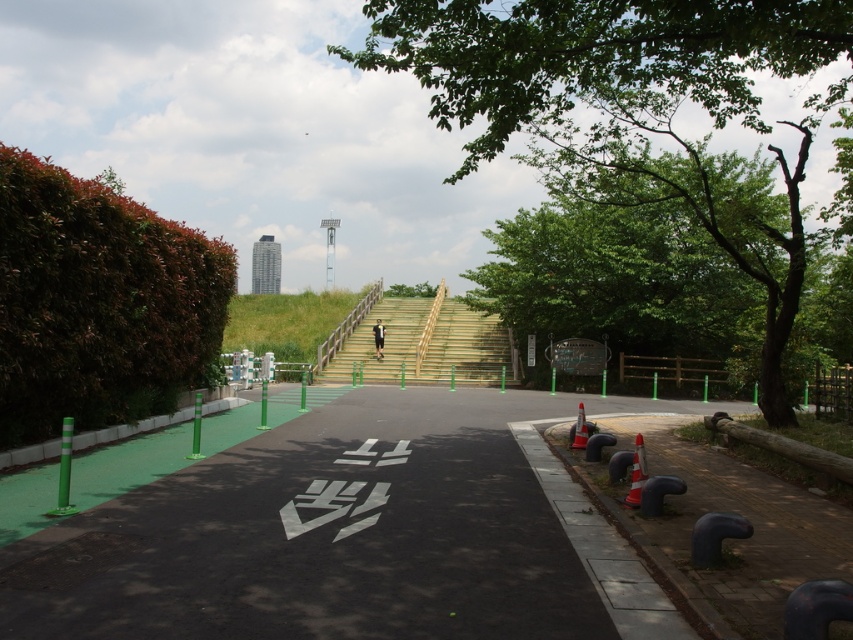
Question: Which object is positioned closest to the orange traffic cone at center?

Choices:
 (A) green leafy tree at center
 (B) blue rubber bollards at lower right
 (C) green leafy bush at left

Answer: (B)

Question: Among these objects, which one is farthest from the camera?

Choices:
 (A) green leafy tree at center
 (B) green leafy bush at left
 (C) black asphalt path at center
 (D) wooden stairs at center

Answer: (D)

Question: Can you confirm if blue rubber bollards at lower right is positioned to the left of wooden stairs at center?

Choices:
 (A) yes
 (B) no

Answer: (B)

Question: Can you confirm if green leafy tree at center is bigger than orange cone at center?

Choices:
 (A) yes
 (B) no

Answer: (A)

Question: Which point is closer to the camera?

Choices:
 (A) orange reflective cone at lower right
 (B) orange cone at center
 (C) green leafy bush at left
 (D) wooden stairs at center

Answer: (A)

Question: Can you confirm if green leafy tree at upper center is positioned below green leafy bush at left?

Choices:
 (A) yes
 (B) no

Answer: (B)